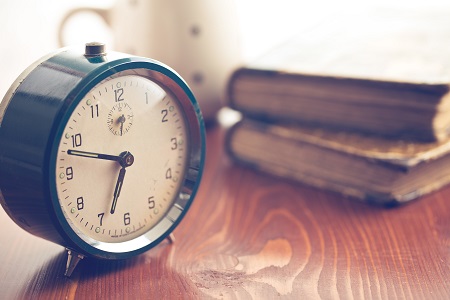
In order to click on mini clock in this screenshot , I will do `click(119, 118)`.